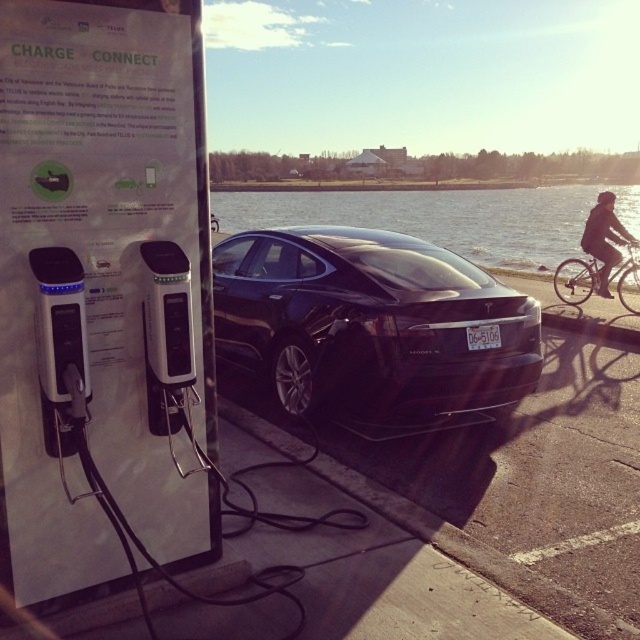
You are standing at the EV charging station and see two points marked in the scene. The first point is at coordinates point [253,216] and the second is at point [586,237]. Which point is closer to you?

Point [253,216] is behind point [586,237], so the point closer to you is point [586,237].

You are a delivery person carrying a package and need to cross from the EV charging station to the waterfront. There is a transparent glass water at center and a dark fabric jacket at upper right in your path. Which object is wider, requiring more space to navigate around?

The transparent glass water at center is wider than the dark fabric jacket at upper right, so you need to allow more space when navigating around the transparent glass water at center.